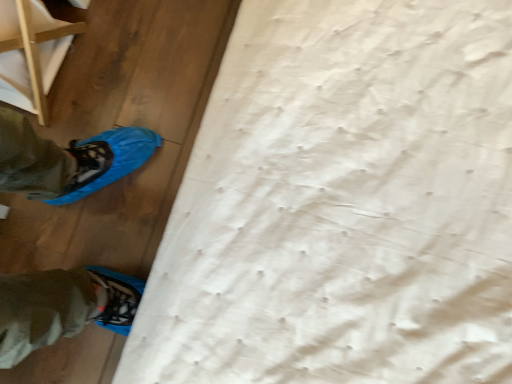
Describe the element at coordinates (36, 51) in the screenshot. I see `wooden chair at upper left` at that location.

Find the location of a particular element. wooden chair at upper left is located at coordinates (36, 51).

What is the approximate width of wooden chair at upper left?

It is 11.47 inches.

Find the location of a particular element. The height and width of the screenshot is (384, 512). wooden chair at upper left is located at coordinates (36, 51).